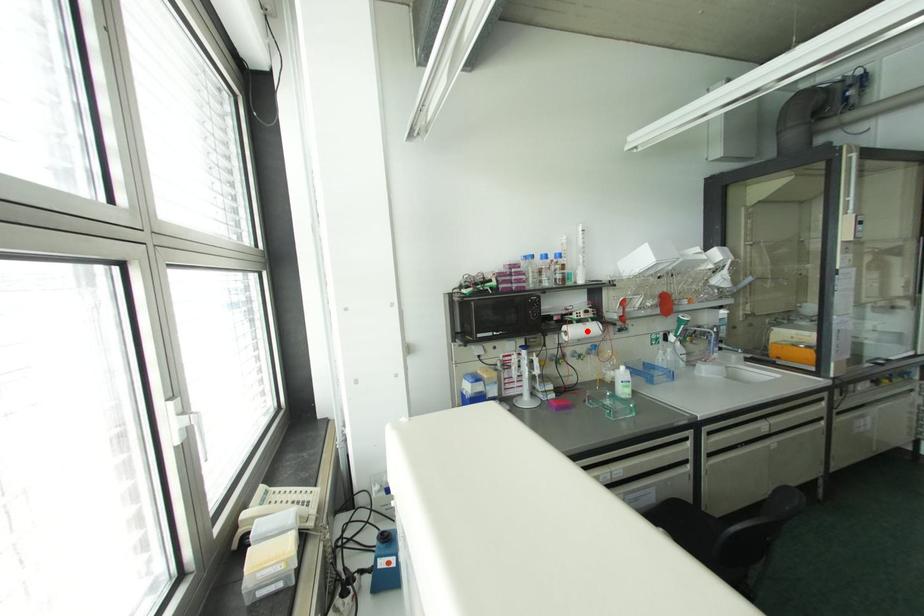
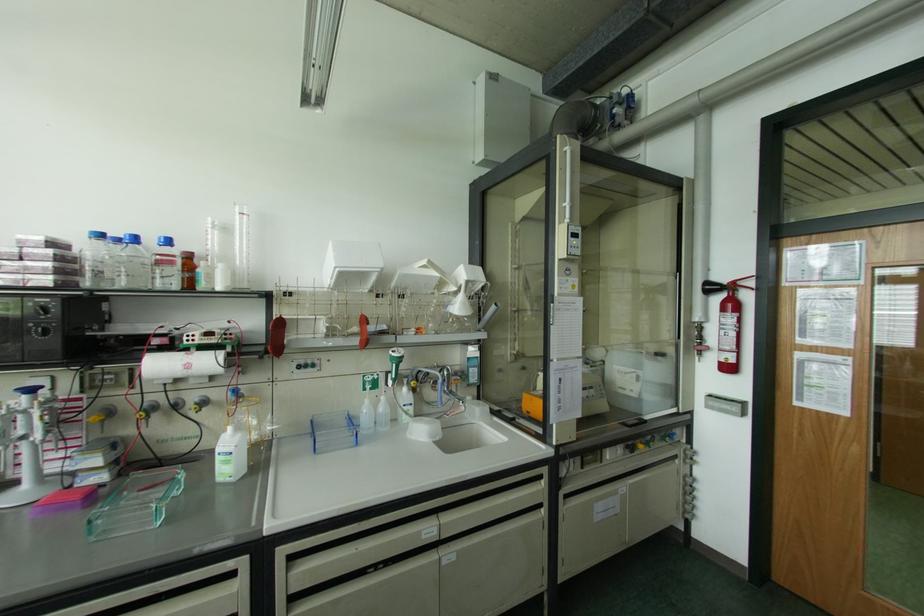
The point at the highlighted location is marked in the first image. Where is the corresponding point in the second image?

(188, 366)